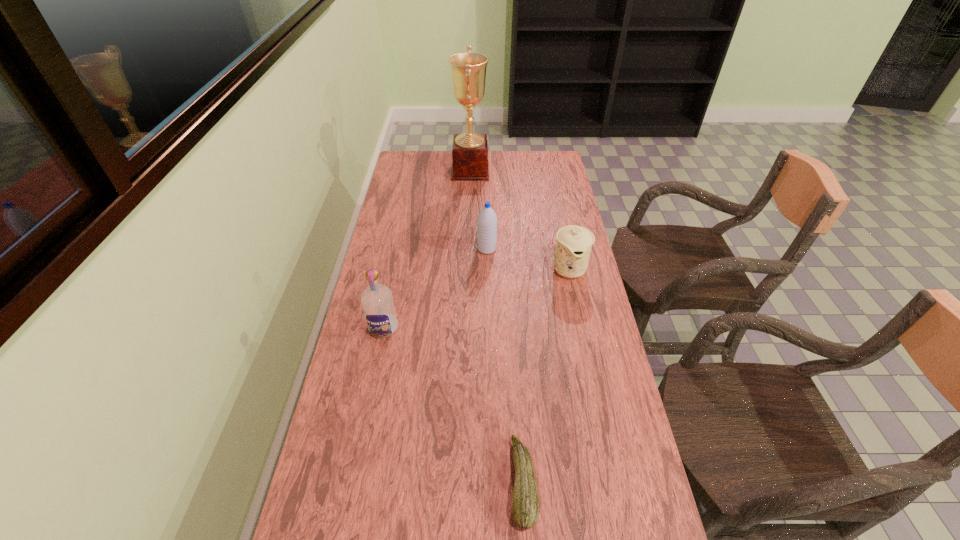
Identify the location of free location that satisfies the following two spatial constraints: 1. on the plaque of the water bottle; 2. on the left side of the trophy cup. The height and width of the screenshot is (540, 960). (468, 249).

Locate an element on the screen. vacant point that satisfies the following two spatial constraints: 1. on the plaque of the tallest object; 2. on the label of the vodka is located at coordinates (466, 328).